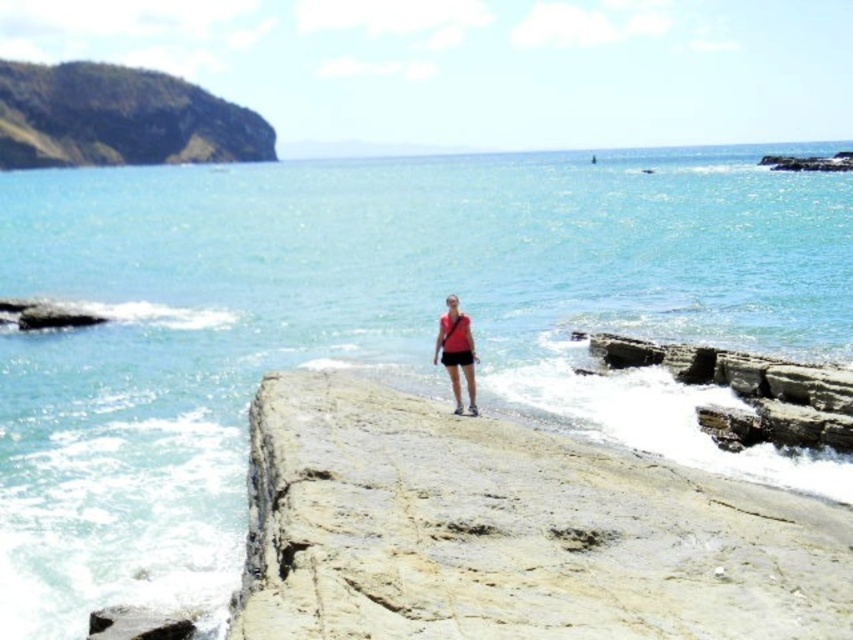
You are a photographer trying to capture the matte red shirt at center and the rough stone rock at lower right in the same frame. Based on their positions, which object would appear closer to the camera in the photo?

The rough stone rock at lower right would appear closer to the camera because it is positioned in front of the matte red shirt at center.

You are a photographer trying to capture the scene of the rocky outcrop and the person. You notice a specific point at coordinates point [511,531]. Based on the description, where exactly is this point located in relation to the rocky outcrop?

The point [511,531] is located on the smooth beige rock at center.